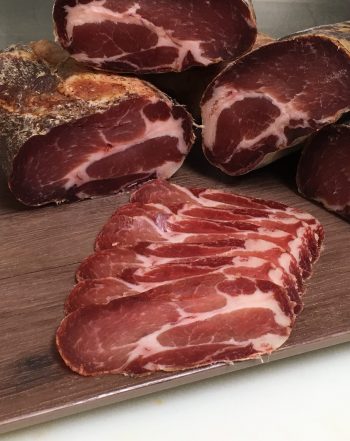
Find the location of `wooden surface`. wooden surface is located at coordinates (38, 312), (25, 237), (330, 324).